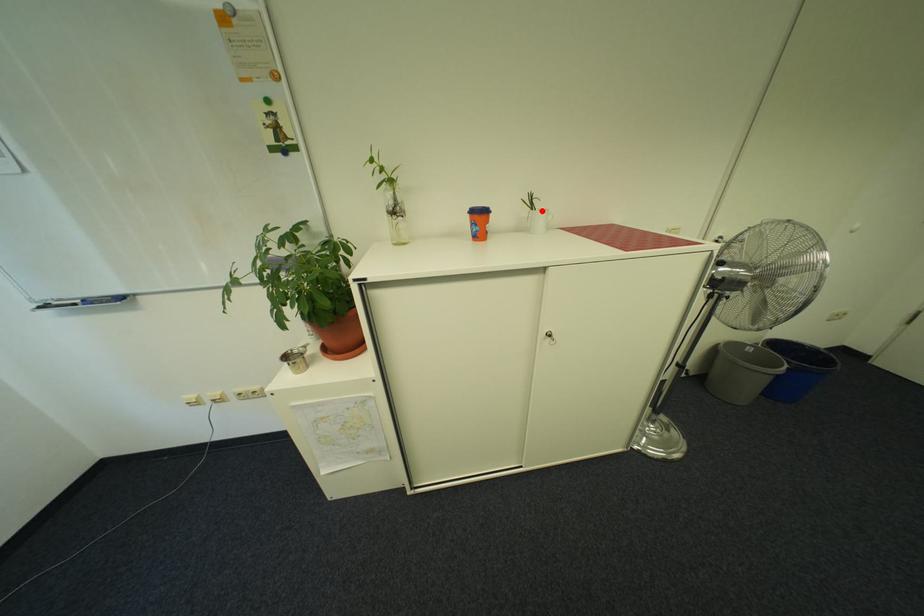
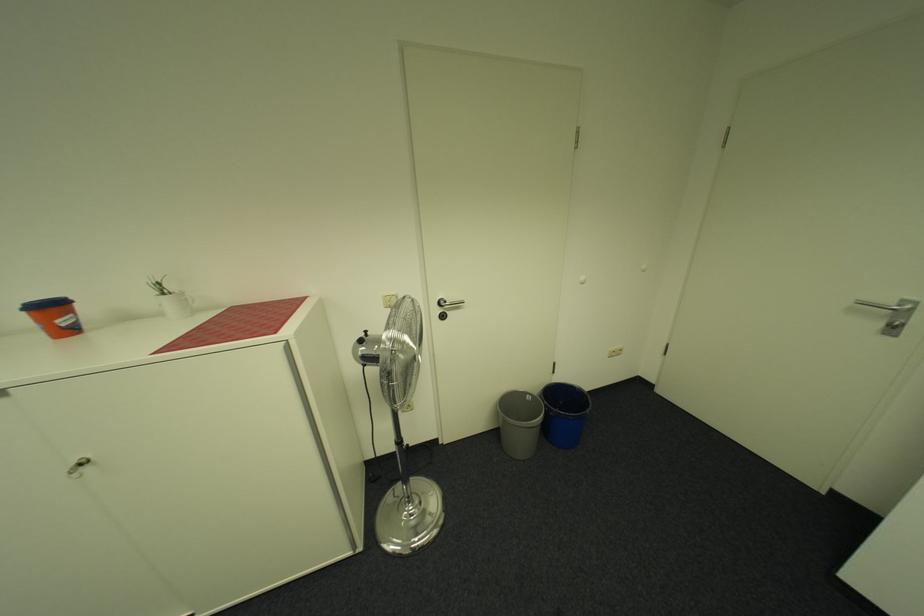
Where in the second image is the point corresponding to the highlighted location from the first image?

(173, 294)